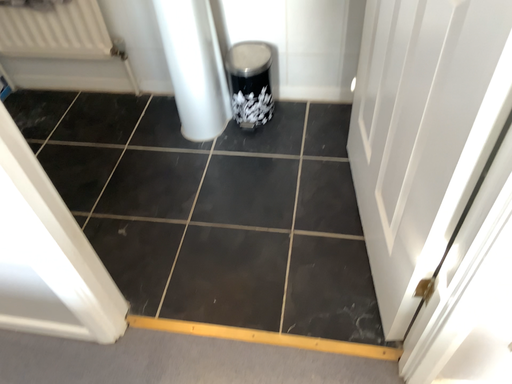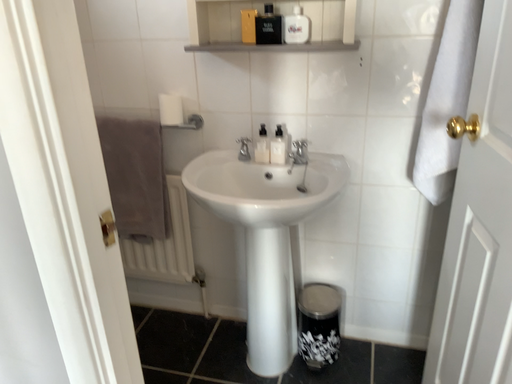
Question: Which way did the camera rotate in the video?

Choices:
 (A) rotated downward
 (B) rotated upward

Answer: (B)